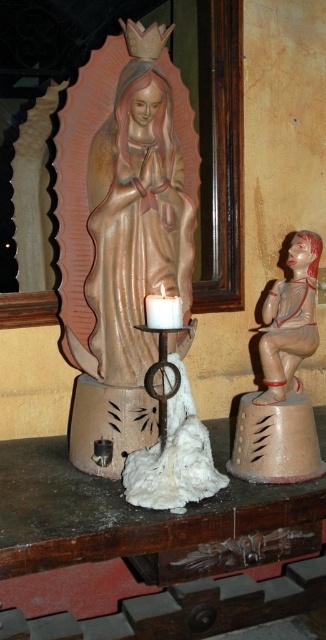
Question: Does matte brown figurine at right come behind white matte candle holder at center?

Choices:
 (A) no
 (B) yes

Answer: (B)

Question: Which object is farther from the camera taking this photo?

Choices:
 (A) white matte candle holder at center
 (B) matte gold statue at center
 (C) matte brown figurine at right

Answer: (C)

Question: Does matte gold statue at center come in front of white matte candle holder at center?

Choices:
 (A) no
 (B) yes

Answer: (A)

Question: Which is farther from the matte gold statue at center?

Choices:
 (A) white matte candle holder at center
 (B) wooden table at center

Answer: (B)

Question: Does wooden table at center come behind matte brown figurine at right?

Choices:
 (A) no
 (B) yes

Answer: (A)

Question: Which object appears closest to the camera in this image?

Choices:
 (A) wooden table at center
 (B) matte brown figurine at right
 (C) matte gold statue at center
 (D) white matte candle holder at center

Answer: (A)